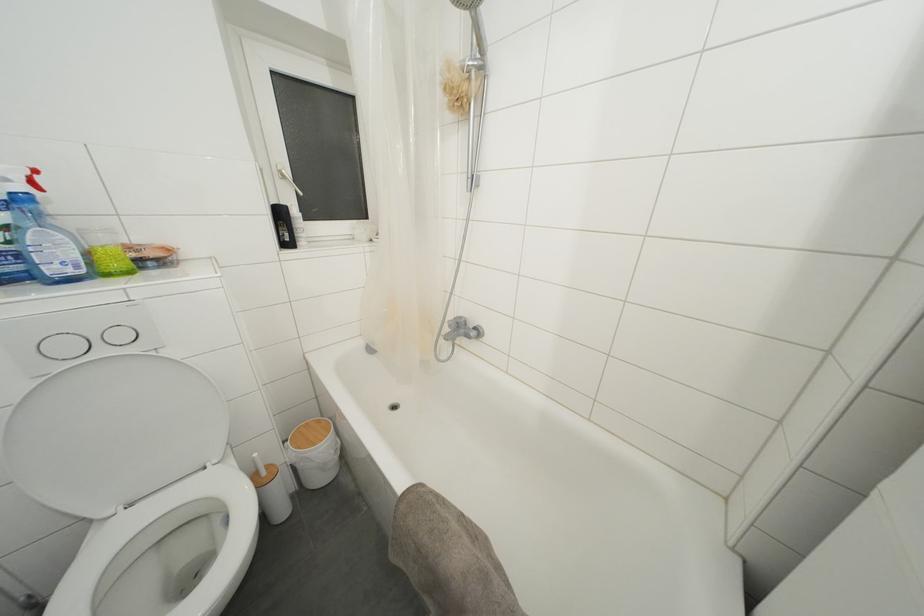
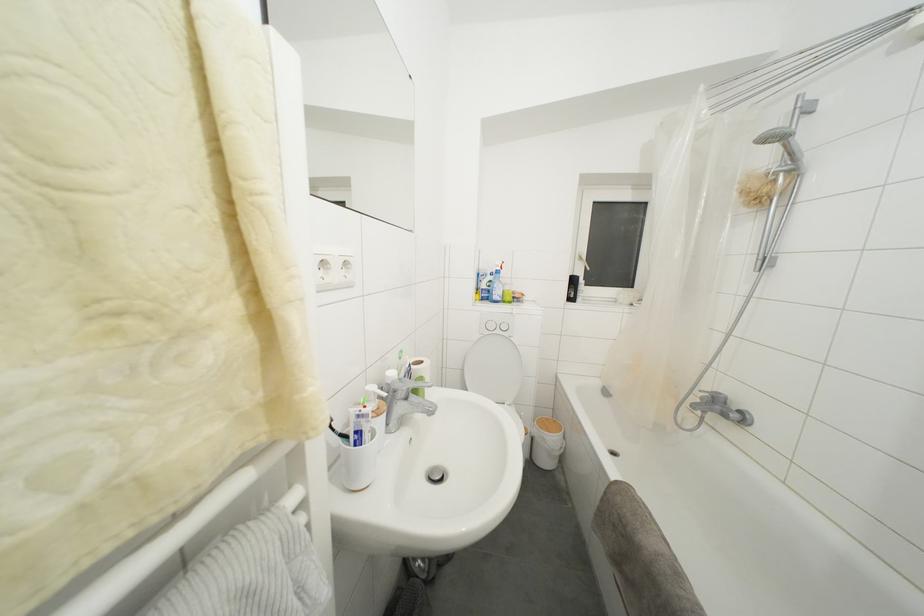
The point at (451,323) is marked in the first image. Where is the corresponding point in the second image?

(703, 392)